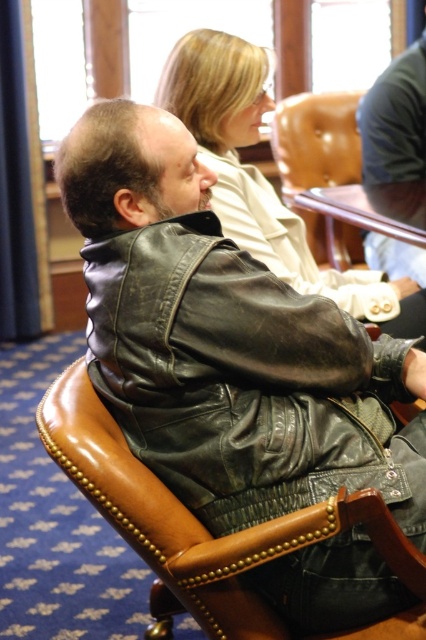
You are standing in the conference room and want to reach the point marked at coordinates point (143, 401). If your maximum comfortable reaching distance is 1.5 meters, can you comfortably reach that point without moving your feet?

The distance between you and the point (143, 401) is 1.39 meters, which is within your maximum comfortable reaching distance of 1.5 meters. Therefore, you can comfortably reach that point without moving your feet.